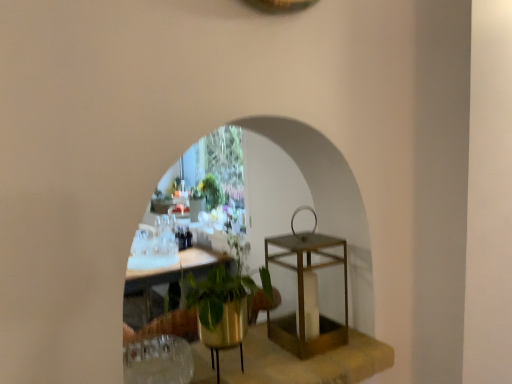
This screenshot has height=384, width=512. I want to click on vacant area in front of gold metallic table at center, so click(x=319, y=365).